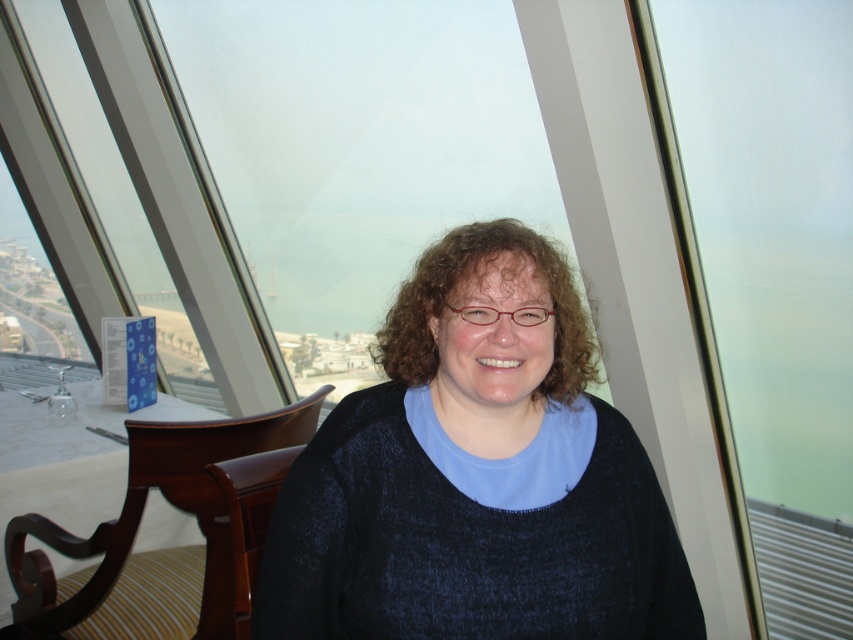
Question: Which object appears farthest from the camera in this image?

Choices:
 (A) black knitted sweater at center
 (B) frosted glass window at center
 (C) mahogany wood chair at lower left

Answer: (B)

Question: Does black knitted sweater at center have a larger size compared to frosted glass window at center?

Choices:
 (A) no
 (B) yes

Answer: (A)

Question: Which of the following is the closest to the observer?

Choices:
 (A) (801, 493)
 (B) (355, 616)
 (C) (97, 582)

Answer: (B)

Question: Among these points, which one is nearest to the camera?

Choices:
 (A) (503, 524)
 (B) (107, 570)
 (C) (807, 36)

Answer: (A)

Question: Does black knitted sweater at center have a greater width compared to frosted glass window at center?

Choices:
 (A) no
 (B) yes

Answer: (A)

Question: Is black knitted sweater at center thinner than frosted glass window at center?

Choices:
 (A) yes
 (B) no

Answer: (A)